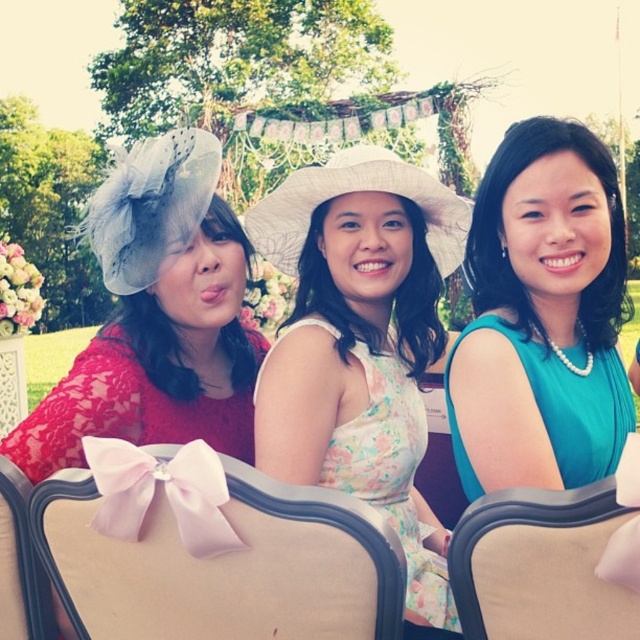
Question: Is floral dress at center closer to camera compared to teal satin dress at center?

Choices:
 (A) yes
 (B) no

Answer: (B)

Question: Estimate the real-world distances between objects in this image. Which object is farther from the beige fabric chair at lower left?

Choices:
 (A) lace fabric hat at left
 (B) floral dress at center

Answer: (B)

Question: Estimate the real-world distances between objects in this image. Which object is farther from the beige fabric chair at lower left?

Choices:
 (A) floral dress at center
 (B) beige fabric chair at center
 (C) pink fabric chair at center

Answer: (A)

Question: Can you confirm if pink fabric chair at center is positioned to the right of beige fabric chair at center?

Choices:
 (A) yes
 (B) no

Answer: (B)

Question: Which is farther from the beige fabric chair at lower left?

Choices:
 (A) teal satin dress at center
 (B) floral dress at center
 (C) lace fabric hat at left
 (D) beige fabric chair at center

Answer: (B)

Question: Can you confirm if teal satin dress at center is wider than beige fabric chair at center?

Choices:
 (A) yes
 (B) no

Answer: (A)